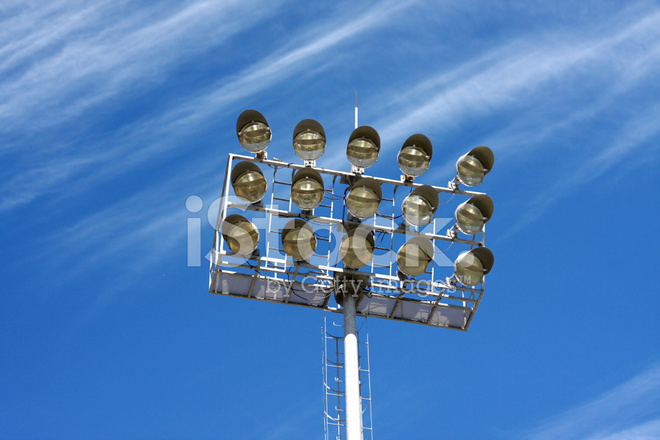
You are a GUI agent. You are given a task and a screenshot of the screen. Output one action in this format:
    pyautogui.click(x=<x>, y=<y>)
    Task: Click on the top row of lights
    
    Given the screenshot: What is the action you would take?
    pyautogui.click(x=249, y=130), pyautogui.click(x=314, y=137), pyautogui.click(x=358, y=145), pyautogui.click(x=414, y=153), pyautogui.click(x=478, y=165)